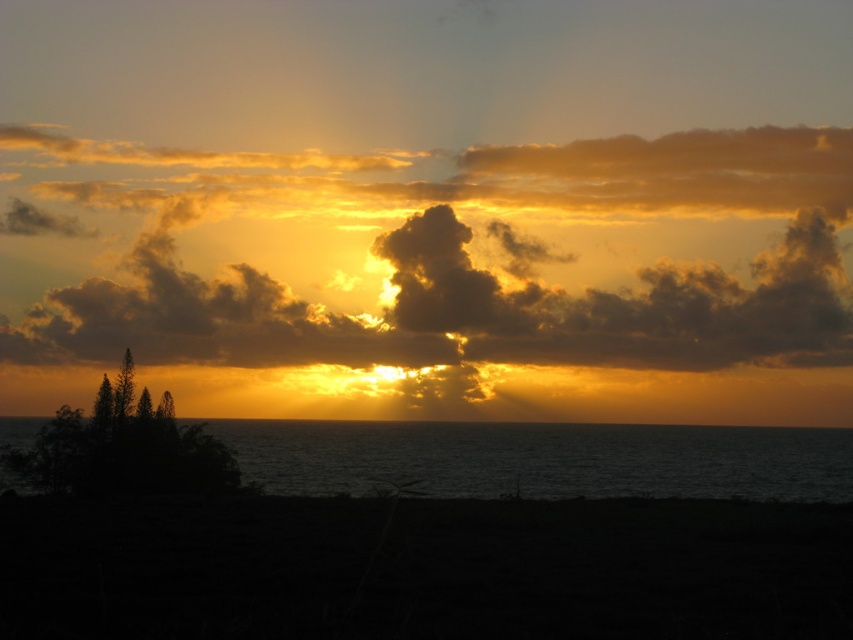
Question: Can you confirm if golden matte cloud at upper center is positioned to the left of dark water at lower center?

Choices:
 (A) no
 (B) yes

Answer: (B)

Question: Is golden matte cloud at upper center bigger than dark water at lower center?

Choices:
 (A) yes
 (B) no

Answer: (B)

Question: Which object appears closest to the camera in this image?

Choices:
 (A) dark water at lower center
 (B) golden matte cloud at upper center

Answer: (A)

Question: Which point is closer to the camera?

Choices:
 (A) (12, 337)
 (B) (305, 426)

Answer: (B)

Question: Does golden matte cloud at upper center appear under dark water at lower center?

Choices:
 (A) no
 (B) yes

Answer: (A)

Question: Which point is closer to the camera?

Choices:
 (A) golden matte cloud at upper center
 (B) dark water at lower center

Answer: (B)